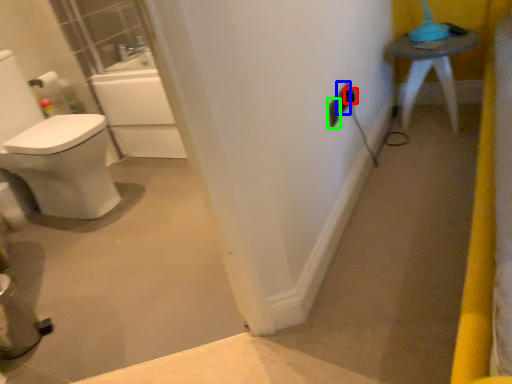
Question: Which object is the farthest from electric outlet (highlighted by a red box)? Choose among these: electric outlet (highlighted by a blue box) or electric outlet (highlighted by a green box).

Choices:
 (A) electric outlet
 (B) electric outlet

Answer: (B)